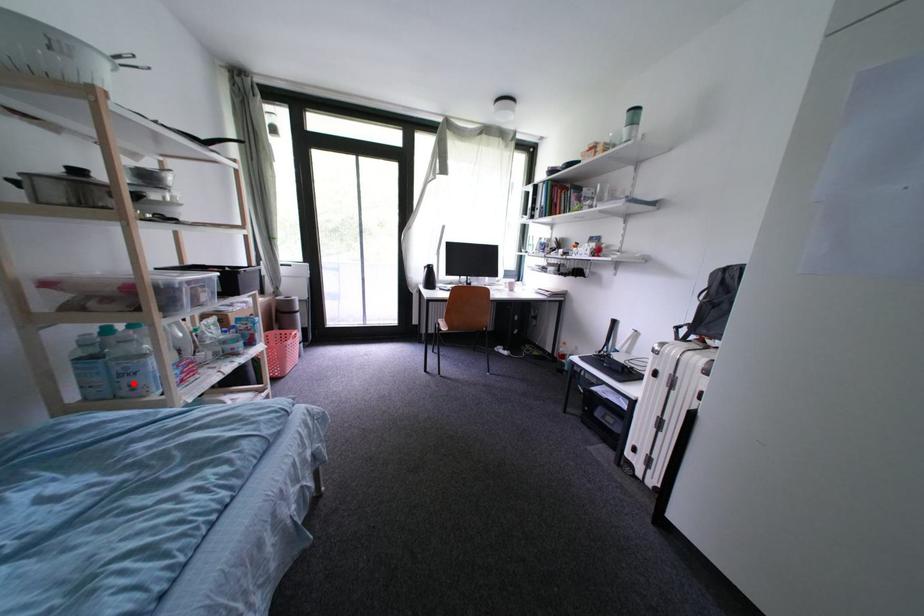
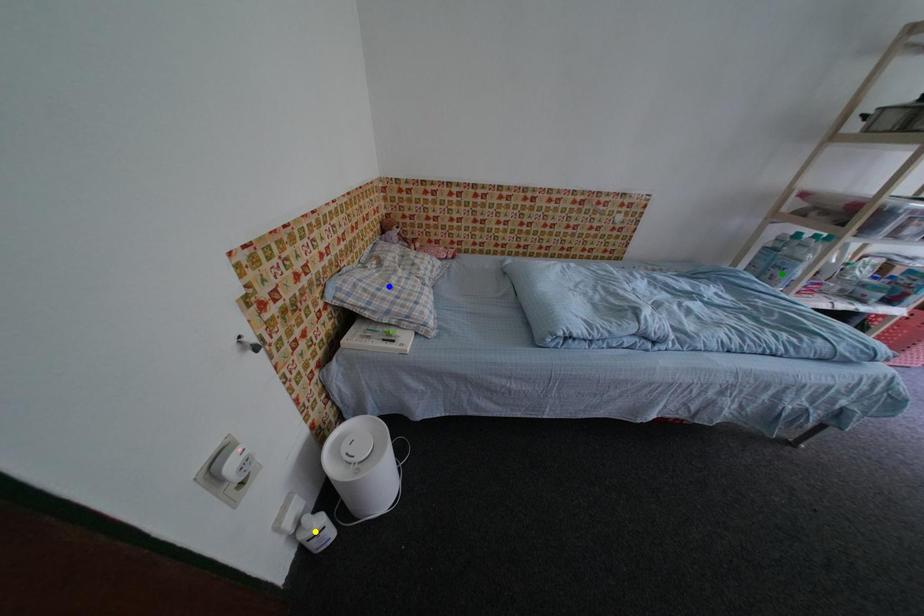
Question: I am providing you with two images of the same scene from different viewpoints. A red point is marked on the first image. You are given multiple points on the second image. Which mark in image 2 goes with the point in image 1?

Choices:
 (A) yellow point
 (B) blue point
 (C) green point

Answer: (C)